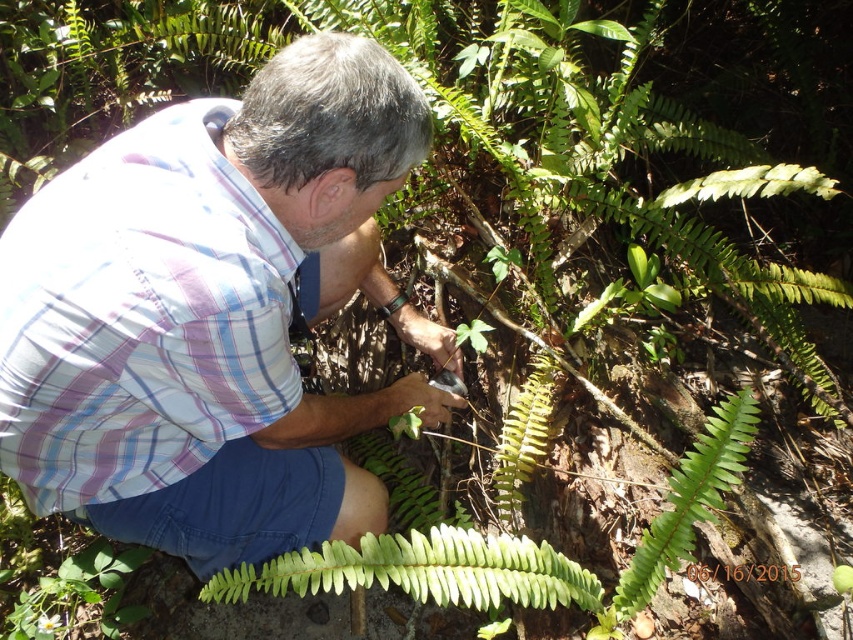
You are a photographer trying to capture a closeup of the plaid fabric shirt at center and the green leafy fern at center. Which object should you focus on first if you want to ensure both are in focus without moving the camera?

The plaid fabric shirt at center is smaller than the green leafy fern at center, so focusing on the larger green leafy fern at center first would help ensure both are in focus since it occupies more of the frame.

You are a photographer trying to capture a closeup of the green leafy fern at center. The plaid fabric shirt at center is blocking your view. Which direction should you move to get a clear shot of the fern?

Since the plaid fabric shirt at center is positioned on the left side of green leafy fern at center, you should move to the right side of the fern to avoid the obstruction from the shirt.